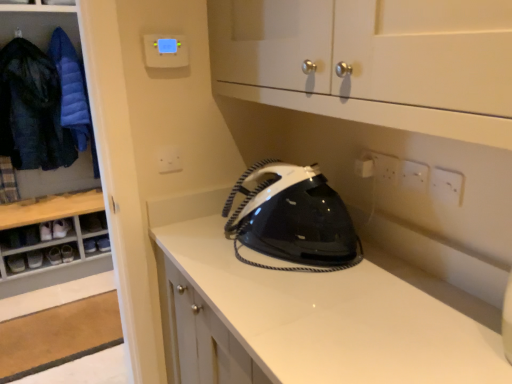
Question: Is dark blue quilted jacket at left, the first clothing in the left-to-right sequence, smaller than white plastic electric outlet at center, which is counted as the 3th electric outlet, starting from the right?

Choices:
 (A) no
 (B) yes

Answer: (A)

Question: Is dark blue quilted jacket at left, the 2th clothing from the right, looking in the opposite direction of white plastic electric outlet at center, which is counted as the 1th electric outlet, starting from the back?

Choices:
 (A) no
 (B) yes

Answer: (A)

Question: From the image's perspective, is dark blue quilted jacket at left, the 2th clothing from the right, beneath white plastic electric outlet at center, which is counted as the 3th electric outlet, starting from the right?

Choices:
 (A) yes
 (B) no

Answer: (B)

Question: From a real-world perspective, is dark blue quilted jacket at left, the 2th clothing from the right, under white plastic electric outlet at center, which is counted as the 1th electric outlet, starting from the back?

Choices:
 (A) no
 (B) yes

Answer: (A)

Question: Is dark blue quilted jacket at left, the first clothing in the left-to-right sequence, to the left of white plastic electric outlet at center, which is counted as the 1th electric outlet, starting from the back, from the viewer's perspective?

Choices:
 (A) no
 (B) yes

Answer: (B)

Question: Based on their sizes in the image, would you say white leather shoe at lower left, placed as the fourth footwear when sorted from bottom to top, is bigger or smaller than white plastic electric outlet at center, the first electric outlet from the left?

Choices:
 (A) small
 (B) big

Answer: (B)

Question: In the image, is white leather shoe at lower left, the second footwear positioned from the top, on the left side or the right side of white plastic electric outlet at center, placed as the third electric outlet when sorted from front to back?

Choices:
 (A) right
 (B) left

Answer: (B)

Question: Considering the positions of white leather shoe at lower left, placed as the fourth footwear when sorted from bottom to top, and white plastic electric outlet at center, which is counted as the 3th electric outlet, starting from the right, in the image, is white leather shoe at lower left, placed as the fourth footwear when sorted from bottom to top, taller or shorter than white plastic electric outlet at center, which is counted as the 3th electric outlet, starting from the right,?

Choices:
 (A) tall
 (B) short

Answer: (A)

Question: From a real-world perspective, relative to white plastic electric outlet at center, the first electric outlet from the left, is white leather shoe at lower left, the second footwear positioned from the top, vertically above or below?

Choices:
 (A) below
 (B) above

Answer: (A)

Question: Is black glossy iron at center taller or shorter than black leather shoe at lower left, the 1th footwear ordered from the bottom?

Choices:
 (A) tall
 (B) short

Answer: (A)

Question: Visually, is black glossy iron at center positioned to the left or to the right of black leather shoe at lower left, the 1th footwear ordered from the bottom?

Choices:
 (A) right
 (B) left

Answer: (A)

Question: Is point (359, 258) positioned closer to the camera than point (18, 269)?

Choices:
 (A) closer
 (B) farther

Answer: (A)

Question: From a real-world perspective, is black glossy iron at center physically located above or below black leather shoe at lower left, the 5th footwear positioned from the top?

Choices:
 (A) above
 (B) below

Answer: (A)

Question: Is dark blue quilted jacket at left, the first clothing in the left-to-right sequence, taller or shorter than blue down jacket at left, positioned as the second clothing in left-to-right order?

Choices:
 (A) short
 (B) tall

Answer: (B)

Question: Is point (14, 152) closer or farther from the camera than point (65, 72)?

Choices:
 (A) farther
 (B) closer

Answer: (B)